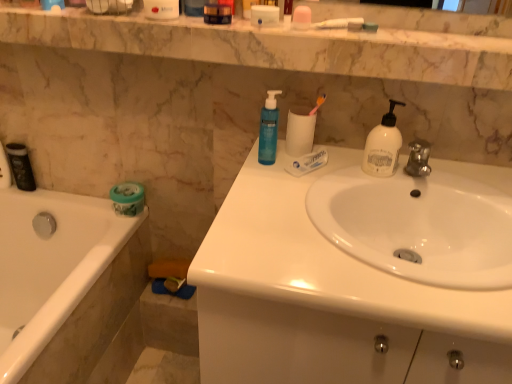
Where is `empty space that is to the right of black matte canister at left`? This screenshot has width=512, height=384. empty space that is to the right of black matte canister at left is located at coordinates (60, 198).